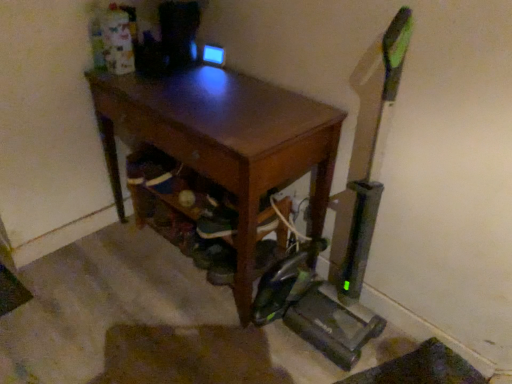
Find the location of `green fabric shoe at lower center`. green fabric shoe at lower center is located at coordinates (222, 268).

Image resolution: width=512 pixels, height=384 pixels. Describe the element at coordinates (222, 268) in the screenshot. I see `green fabric shoe at lower center` at that location.

Locate an element on the screen. The image size is (512, 384). brown wooden desk at center is located at coordinates (226, 141).

Describe the element at coordinates (226, 141) in the screenshot. I see `brown wooden desk at center` at that location.

Where is `green fabric shoe at lower center`? The width and height of the screenshot is (512, 384). green fabric shoe at lower center is located at coordinates (222, 268).

Looking at this image, can you confirm if green fabric shoe at lower center is positioned to the right of brown wooden desk at center?

Indeed, green fabric shoe at lower center is positioned on the right side of brown wooden desk at center.

Considering the positions of objects green fabric shoe at lower center and brown wooden desk at center in the image provided, who is behind, green fabric shoe at lower center or brown wooden desk at center?

green fabric shoe at lower center.

Which point is more forward, (x=224, y=269) or (x=260, y=105)?

The point (x=260, y=105) is closer to the camera.

From the image's perspective, which is above, green fabric shoe at lower center or brown wooden desk at center?

From the image's view, brown wooden desk at center is above.

In the scene shown: From a real-world perspective, is green fabric shoe at lower center below brown wooden desk at center?

Yes, from a real-world perspective, green fabric shoe at lower center is below brown wooden desk at center.

Which of these two, green fabric shoe at lower center or brown wooden desk at center, is thinner?

Thinner between the two is green fabric shoe at lower center.

Is green fabric shoe at lower center shorter than brown wooden desk at center?

Indeed, green fabric shoe at lower center has a lesser height compared to brown wooden desk at center.

Considering the sizes of objects green fabric shoe at lower center and brown wooden desk at center in the image provided, who is bigger, green fabric shoe at lower center or brown wooden desk at center?

brown wooden desk at center is bigger.

Would you say green fabric shoe at lower center contains brown wooden desk at center?

That's incorrect, brown wooden desk at center is not inside green fabric shoe at lower center.

Is green fabric shoe at lower center next to brown wooden desk at center and touching it?

green fabric shoe at lower center and brown wooden desk at center are clearly separated.

Based on the photo, is green fabric shoe at lower center positioned with its back to brown wooden desk at center?

Yes, green fabric shoe at lower center is positioned with its back facing brown wooden desk at center.

How different are the orientations of green fabric shoe at lower center and brown wooden desk at center in degrees?

1.96 degrees separate the facing orientations of green fabric shoe at lower center and brown wooden desk at center.

In the image, there is a brown wooden desk at center. Where is `shoe below it (from a real-world perspective)`? The height and width of the screenshot is (384, 512). shoe below it (from a real-world perspective) is located at coordinates pyautogui.click(x=222, y=268).

Is brown wooden desk at center to the right of green fabric shoe at lower center from the viewer's perspective?

In fact, brown wooden desk at center is to the left of green fabric shoe at lower center.

Between brown wooden desk at center and green fabric shoe at lower center, which one is positioned behind?

green fabric shoe at lower center.

Which is closer to the camera, (162, 98) or (230, 280)?

Point (162, 98) is closer to the camera than point (230, 280).

From the image's perspective, does brown wooden desk at center appear higher than green fabric shoe at lower center?

Yes, from the image's perspective, brown wooden desk at center is over green fabric shoe at lower center.

From a real-world perspective, which object rests below the other?

In real-world perspective, green fabric shoe at lower center is lower.

Which of these two, brown wooden desk at center or green fabric shoe at lower center, is wider?

Wider between the two is brown wooden desk at center.

Does brown wooden desk at center have a lesser height compared to green fabric shoe at lower center?

In fact, brown wooden desk at center may be taller than green fabric shoe at lower center.

Based on their sizes in the image, would you say brown wooden desk at center is bigger or smaller than green fabric shoe at lower center?

Clearly, brown wooden desk at center is larger in size than green fabric shoe at lower center.

Is green fabric shoe at lower center a part of brown wooden desk at center?

Yes, green fabric shoe at lower center is a part of brown wooden desk at center.

Are brown wooden desk at center and green fabric shoe at lower center far apart?

No, there isn't a large distance between brown wooden desk at center and green fabric shoe at lower center.

Is brown wooden desk at center turned away from green fabric shoe at lower center?

Yes, brown wooden desk at center is facing away from green fabric shoe at lower center.

What's the angular difference between brown wooden desk at center and green fabric shoe at lower center's facing directions?

The angular difference between brown wooden desk at center and green fabric shoe at lower center is 1.96 degrees.

At what (x,y) coordinates should I click in order to perform the action: click on shoe on the right of brown wooden desk at center. Please return your answer as a coordinate pair (x, y). This screenshot has height=384, width=512. Looking at the image, I should click on (222, 268).

Locate an element on the screen. The image size is (512, 384). shoe located on the right of brown wooden desk at center is located at coordinates (222, 268).

The width and height of the screenshot is (512, 384). In order to click on desk to the left of green fabric shoe at lower center in this screenshot , I will do `click(226, 141)`.